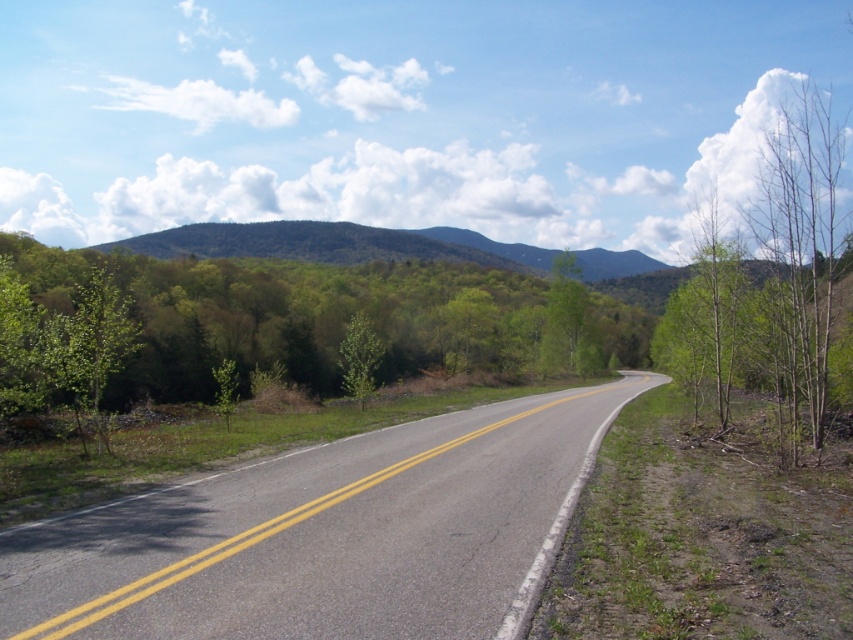
Is point (585, 296) farther from camera compared to point (345, 388)?

Yes, it is behind point (345, 388).

Can you confirm if green leafy tree at center is thinner than green matte tree at center?

No, green leafy tree at center is not thinner than green matte tree at center.

The image size is (853, 640). What are the coordinates of `green leafy tree at center` in the screenshot? It's located at (570, 317).

You are a GUI agent. You are given a task and a screenshot of the screen. Output one action in this format:
    pyautogui.click(x=<x>, y=<y>)
    Task: Click on the asphalt road at center
    The height and width of the screenshot is (640, 853).
    Given the screenshot: What is the action you would take?
    pyautogui.click(x=328, y=536)

Can you confirm if asphalt road at center is wider than green matte tree at center?

Correct, the width of asphalt road at center exceeds that of green matte tree at center.

Who is more distant from viewer, (519, 456) or (364, 316)?

Point (364, 316)

Locate an element on the screen. asphalt road at center is located at coordinates (328, 536).

Can you confirm if asphalt road at center is wider than green leafy tree at left?

No.

Identify the location of asphalt road at center. (328, 536).